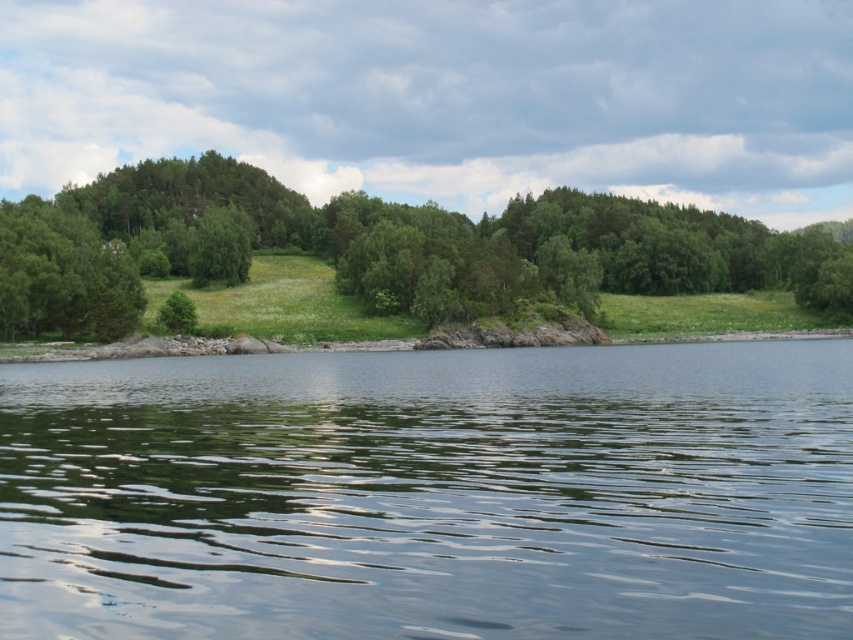
Question: Is the position of green reflective water at center less distant than that of green leafy trees at center?

Choices:
 (A) no
 (B) yes

Answer: (B)

Question: Which point is closer to the camera?

Choices:
 (A) green reflective water at center
 (B) green leafy trees at center

Answer: (A)

Question: Does green reflective water at center come behind green leafy trees at center?

Choices:
 (A) no
 (B) yes

Answer: (A)

Question: Can you confirm if green reflective water at center is positioned above green leafy trees at center?

Choices:
 (A) yes
 (B) no

Answer: (B)